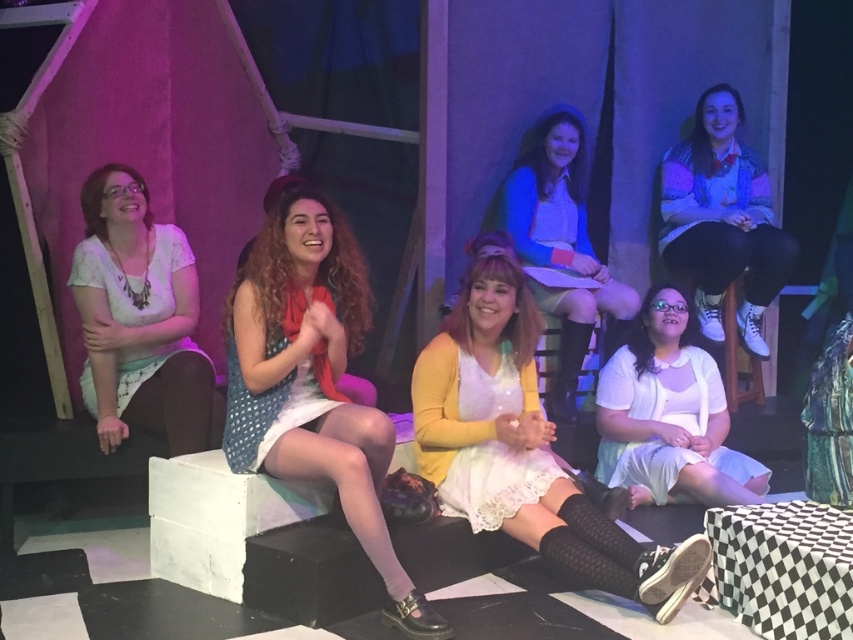
Is matte white blouse at left wider than matte blue sweater at center?

No.

Is matte white blouse at left above matte blue sweater at center?

Incorrect, matte white blouse at left is not positioned above matte blue sweater at center.

This screenshot has width=853, height=640. What do you see at coordinates (138, 320) in the screenshot? I see `matte white blouse at left` at bounding box center [138, 320].

This screenshot has height=640, width=853. I want to click on matte white blouse at left, so click(138, 320).

Is matte white blouse at left thinner than white satin dress at lower center?

Yes, matte white blouse at left is thinner than white satin dress at lower center.

Can you confirm if matte white blouse at left is positioned to the right of white satin dress at lower center?

Incorrect, matte white blouse at left is not on the right side of white satin dress at lower center.

Is point (146, 400) in front of point (680, 324)?

That is True.

Locate an element on the screen. The height and width of the screenshot is (640, 853). matte white blouse at left is located at coordinates (138, 320).

Which of these two, polka dot fabric dress at center or white satin dress at lower center, stands shorter?

Standing shorter between the two is white satin dress at lower center.

Identify the location of polka dot fabric dress at center. coord(312,381).

Locate an element on the screen. polka dot fabric dress at center is located at coordinates (312, 381).